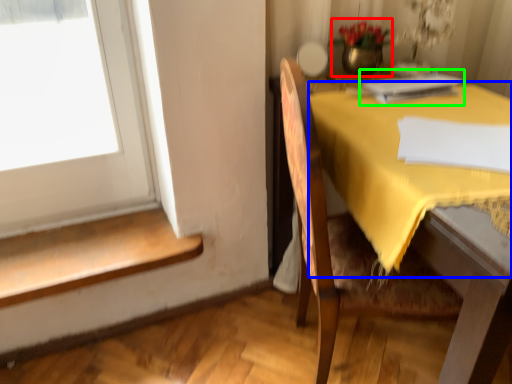
Question: Which object is the farthest from floral arrangement (highlighted by a red box)? Choose among these: tablecloth (highlighted by a blue box) or book (highlighted by a green box).

Choices:
 (A) tablecloth
 (B) book

Answer: (A)